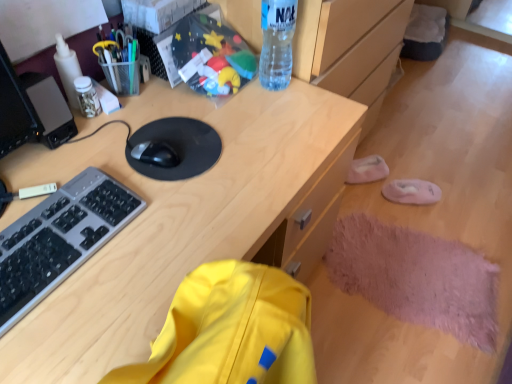
You are a GUI agent. You are given a task and a screenshot of the screen. Output one action in this format:
    pyautogui.click(x=<x>, y=<y>)
    Task: Click on the vacant area located to the right-hand side of gray plastic keyboard at left
    This screenshot has height=384, width=512.
    Given the screenshot: What is the action you would take?
    point(147,252)